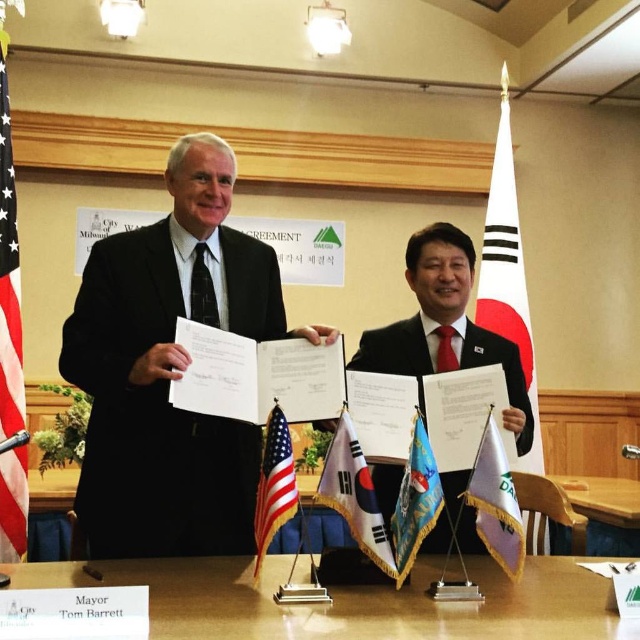
Question: Which object is the farthest from the white fabric flag at right?

Choices:
 (A) matte black suit at center
 (B) light brown wood table at center
 (C) white fabric flag at center

Answer: (C)

Question: Among these objects, which one is farthest from the camera?

Choices:
 (A) white fabric flag at center
 (B) american flag at center

Answer: (A)

Question: Is white fabric flag at center to the right of light brown wood table at center from the viewer's perspective?

Choices:
 (A) yes
 (B) no

Answer: (B)

Question: Which of the following is the farthest from the observer?

Choices:
 (A) (492, 324)
 (B) (150, 387)
 (C) (419, 506)
 (D) (460, 609)

Answer: (A)

Question: Does black suit at center come behind purple fabric flag at right?

Choices:
 (A) yes
 (B) no

Answer: (A)

Question: Does brown wooden table at center appear under white fabric flag at right?

Choices:
 (A) yes
 (B) no

Answer: (A)